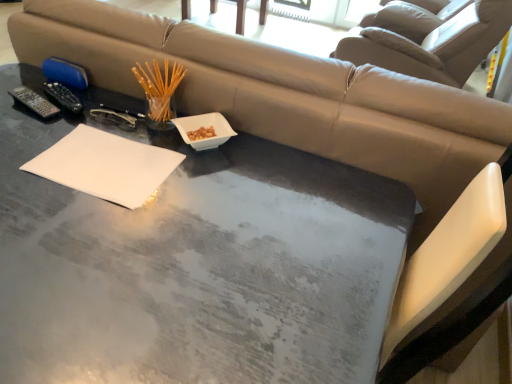
You are a GUI agent. You are given a task and a screenshot of the screen. Output one action in this format:
    pyautogui.click(x=<x>, y=<y>)
    Task: Click on the free area in between translucent glass chopsticks at upper left and white matte notepad at center
    The image size is (512, 384).
    Given the screenshot: What is the action you would take?
    pyautogui.click(x=133, y=132)